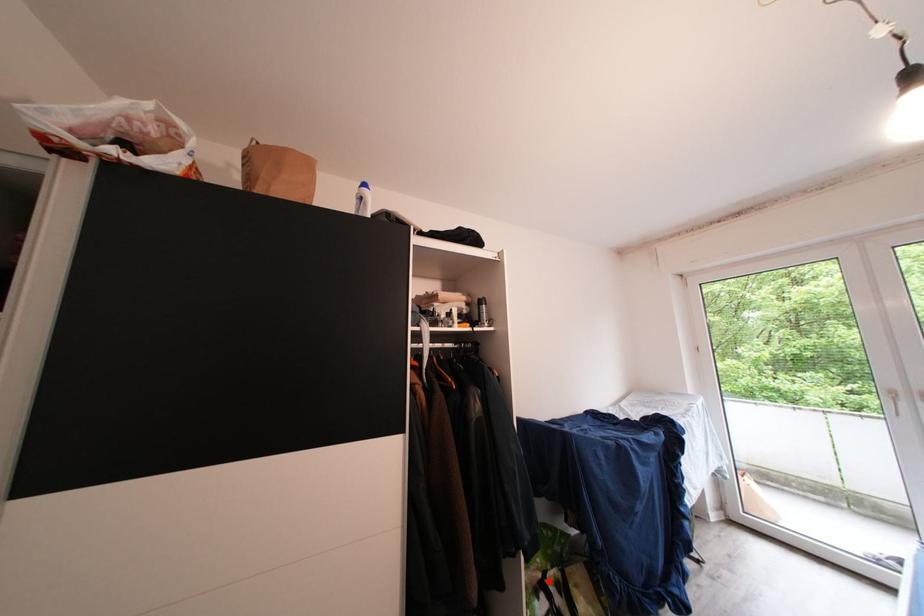
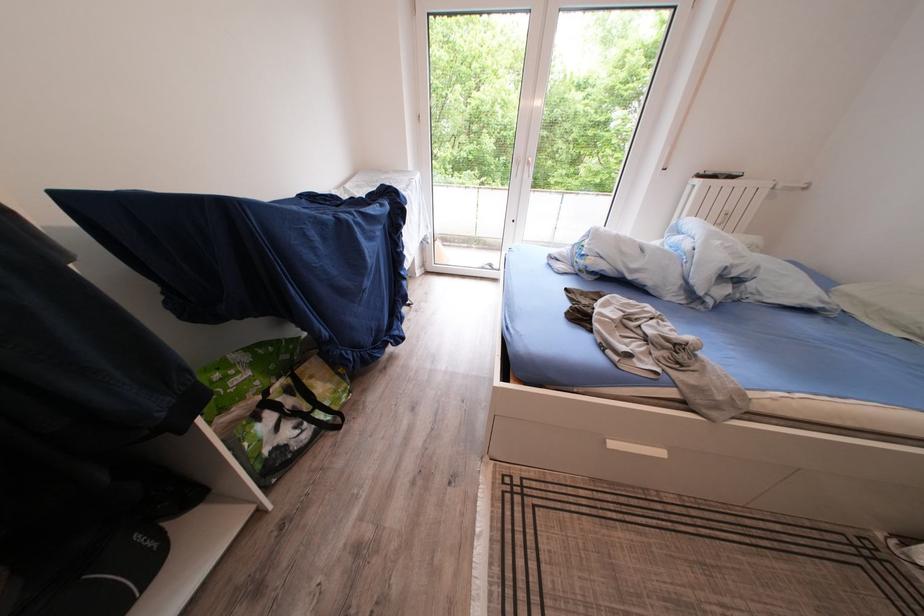
Question: I am providing you with two images of the same scene from different viewpoints. Given a red point in image1, look at the same physical point in image2. Is it:

Choices:
 (A) Closer to the viewpoint
 (B) Farther from the viewpoint

Answer: (A)